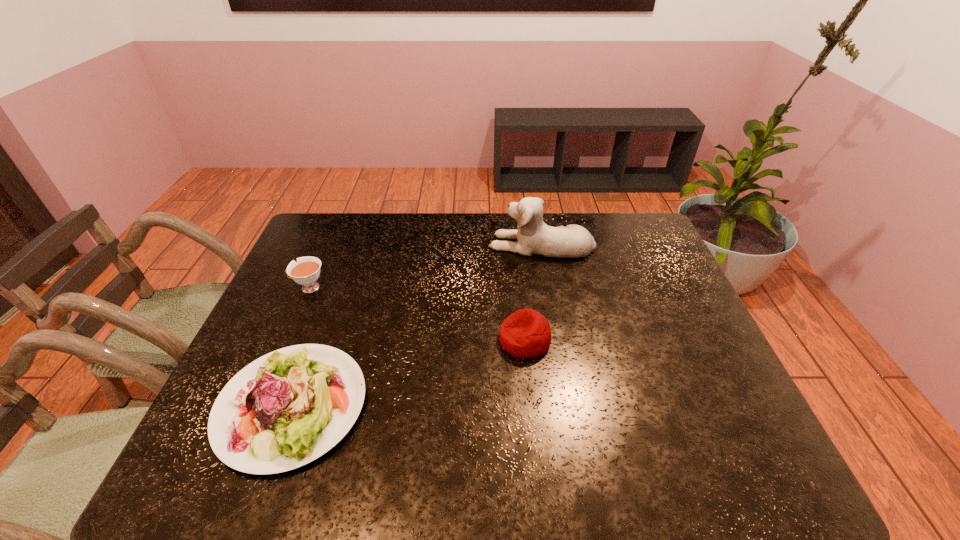
At what (x,y) coordinates should I click in order to perform the action: click on puppy. Please return your answer as a coordinate pair (x, y). Image resolution: width=960 pixels, height=540 pixels. Looking at the image, I should click on (534, 236).

Where is `the tallest object`? The width and height of the screenshot is (960, 540). the tallest object is located at coordinates pos(534,236).

Identify the location of teacup. This screenshot has height=540, width=960. (306, 271).

Identify the location of beanbag. The image size is (960, 540). (526, 333).

Image resolution: width=960 pixels, height=540 pixels. I want to click on salad plate, so 287,408.

Where is `free region located on the front-facing side of the farthest object`? The height and width of the screenshot is (540, 960). free region located on the front-facing side of the farthest object is located at coordinates (432, 244).

Locate an element on the screen. The image size is (960, 540). free region located 0.310m on the front-facing side of the farthest object is located at coordinates (396, 244).

Find the location of a particular element. vacant point located 0.170m on the front-facing side of the farthest object is located at coordinates pyautogui.click(x=438, y=244).

In order to click on free space located on the seat area of the beanbag in this screenshot , I will do `click(407, 339)`.

I want to click on free region located 0.220m on the seat area of the beanbag, so click(415, 339).